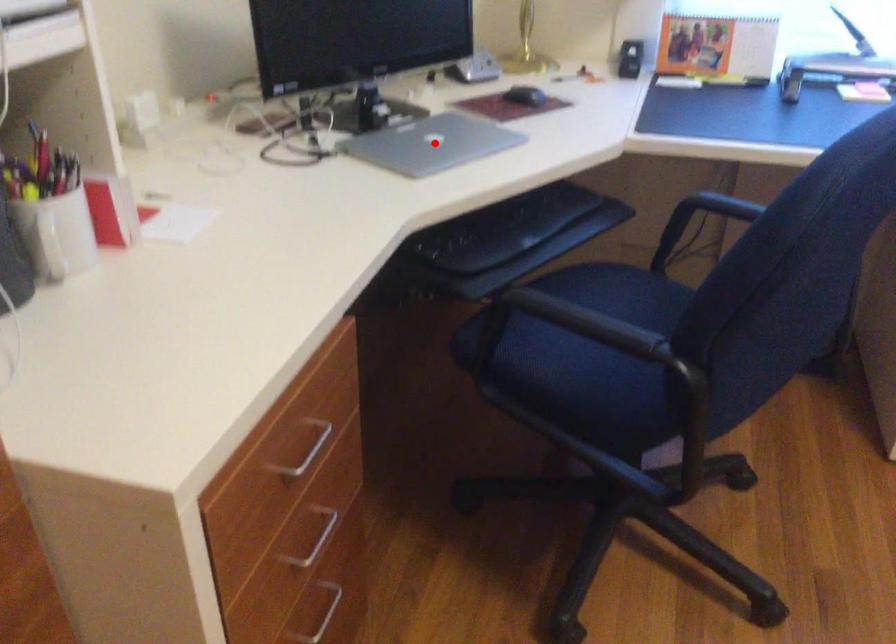
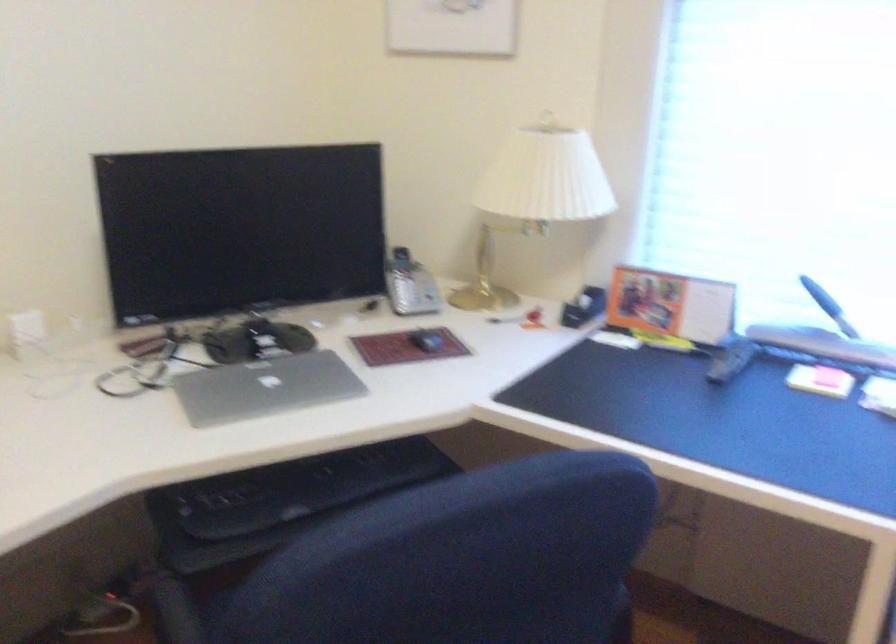
Question: I am providing you with two images of the same scene from different viewpoints. A red point is marked on the first image. Can you still see the location of the red point in image 2?

Choices:
 (A) Yes
 (B) No

Answer: (A)